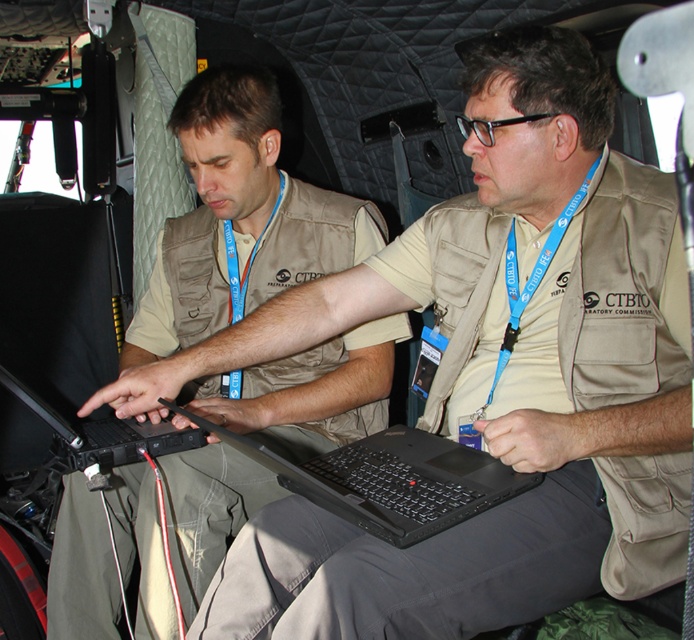
You are a CTBTO inspector checking the equipment in the aircraft. You notice the matte khaki vest at center and the blue fabric lanyard at center. Which item is positioned lower in the image?

The matte khaki vest at center is located below the blue fabric lanyard at center, so the matte khaki vest at center is positioned lower in the image.

You are a CTBTO inspector checking the equipment inside the aircraft. You need to place the blue fabric lanyard at center and the black matte laptop at center into a storage compartment. The compartment has a width of 12 inches. Can both items fit side by side without overlapping?

The blue fabric lanyard at center has a width less than the black matte laptop at center. Since the compartment is 12 inches wide, and the laptop is wider than the lanyard, but the exact widths are not provided, it is uncertain if both can fit. However, if the combined width of both items is under 12 inches, they could potentially fit side by side.

You are a technician who needs to retrieve a tool from your pocket. The tool requires a clear line of sight to the black plastic laptop at center. Can you reach it without moving your body?

The black plastic laptop at center is 34.22 inches from viewer. Since the tool requires a clear line of sight and the distance is sufficient, you can likely reach it without moving your body.